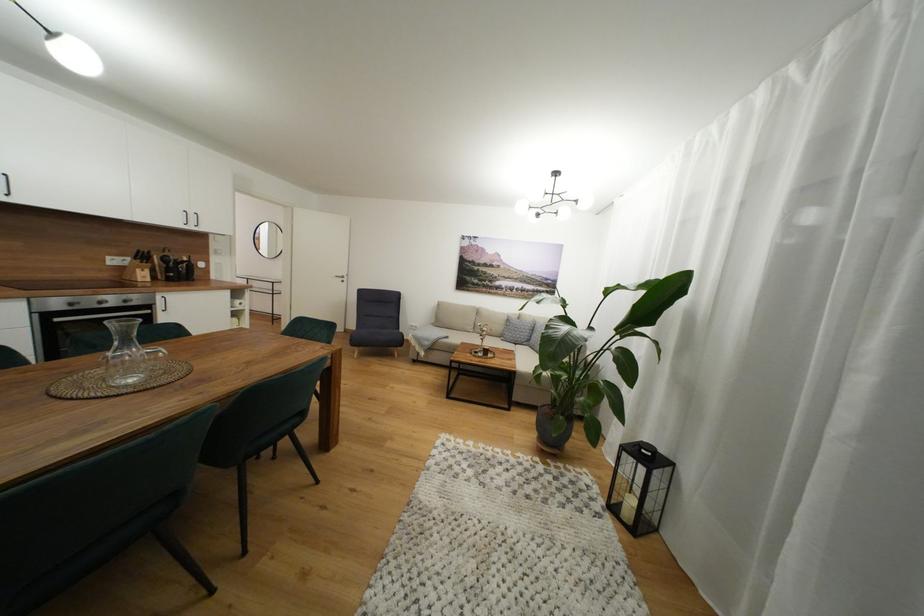
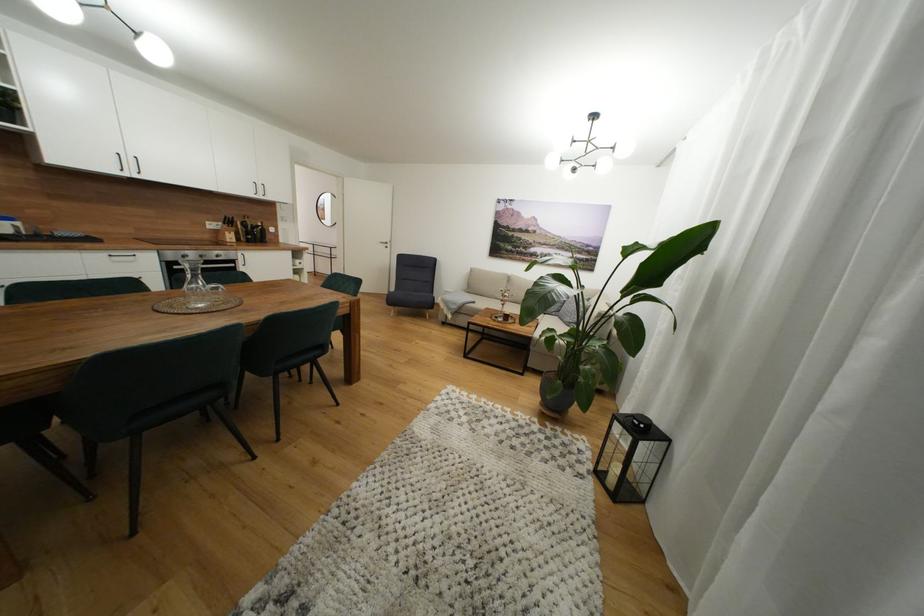
Question: What movement of the cameraman would produce the second image?

Choices:
 (A) Left
 (B) Right
 (C) Forward
 (D) Backward

Answer: (B)